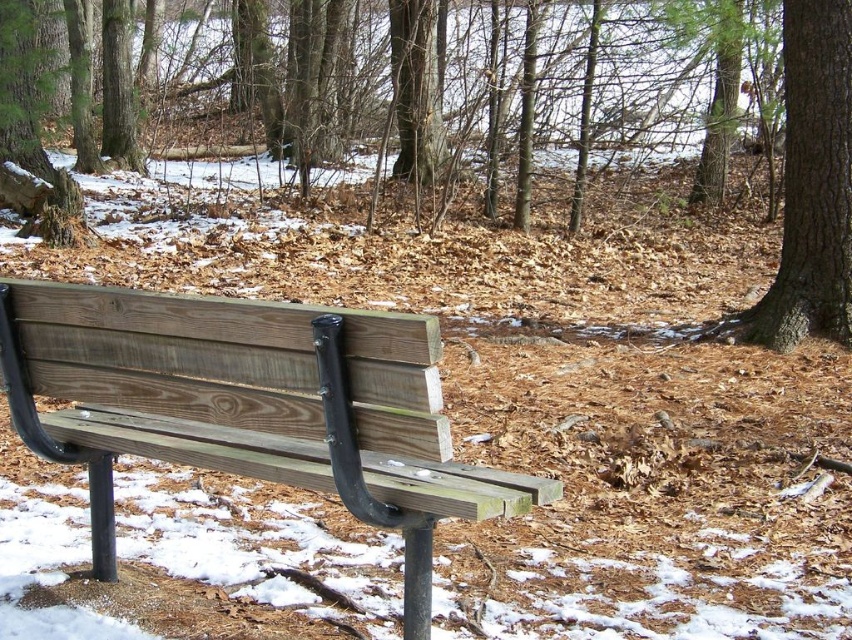
You are planning to place a small potted plant between the wooden bench at center and the brown rough bark tree at upper right. Given their sizes, which object should the plant be closer to to ensure it doesn

The wooden bench at center is wider than the brown rough bark tree at upper right. Therefore, the plant should be placed closer to the brown rough bark tree at upper right to ensure there is enough space between them.

You are standing in the winter forest scene and want to determine which of the two points, point (180, 298) or point (763, 340), is nearer to you. Based on the scene, which point is closer?

Point (180, 298) is closer to the camera than point (763, 340), so it is the nearer one.

You are a hiker who wants to take a break. You see the wooden bench at center and the brown rough bark tree at upper right. Which object is closer to the left edge of the image?

The wooden bench at center is positioned on the left side of brown rough bark tree at upper right, so the wooden bench at center is closer to the left edge of the image.